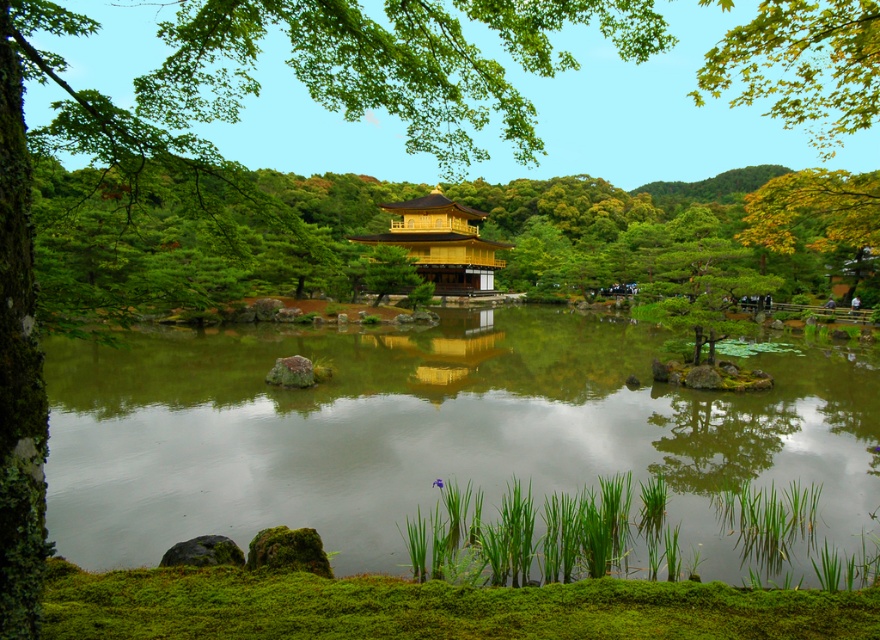
How much distance is there between green reflective water at center and gold/reflective/gazebo at center?

green reflective water at center and gold/reflective/gazebo at center are 133.99 feet apart from each other.

Is green reflective water at center positioned at the back of gold/reflective/gazebo at center?

No, it is not.

What do you see at coordinates (440, 433) in the screenshot?
I see `green reflective water at center` at bounding box center [440, 433].

Locate an element on the screen. This screenshot has width=880, height=640. green reflective water at center is located at coordinates (440, 433).